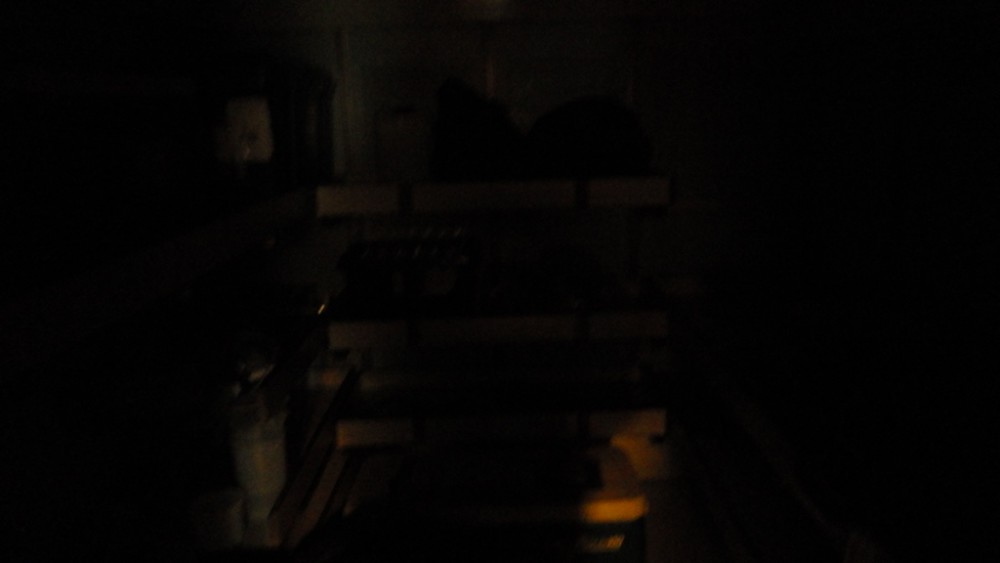
This screenshot has width=1000, height=563. In order to click on grey brick wall in this screenshot , I will do `click(580, 47)`.